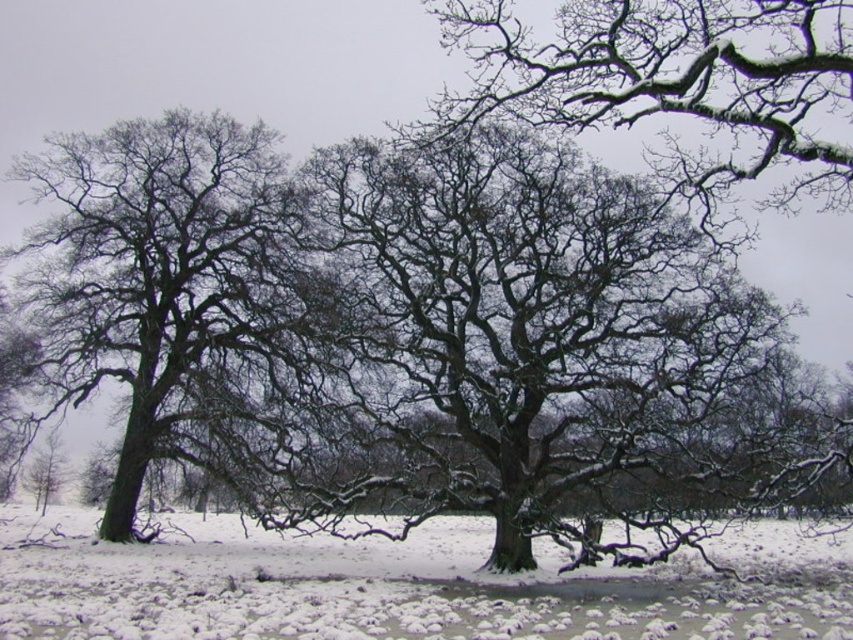
Question: Is white powdery snow at center to the right of snow-covered branches at upper center from the viewer's perspective?

Choices:
 (A) yes
 (B) no

Answer: (B)

Question: Which point appears farthest from the camera in this image?

Choices:
 (A) (209, 237)
 (B) (730, 64)

Answer: (A)

Question: Does white powdery snow at center appear over snow-covered branches at upper center?

Choices:
 (A) yes
 (B) no

Answer: (B)

Question: Among these objects, which one is nearest to the camera?

Choices:
 (A) snow-covered branches at left
 (B) snow-covered branches at upper center
 (C) white powdery snow at center

Answer: (B)

Question: Which object is closer to the camera taking this photo?

Choices:
 (A) snow-covered branches at upper center
 (B) snow-covered branches at left

Answer: (A)

Question: Is snow-covered branches at left closer to the viewer compared to snow-covered branches at upper center?

Choices:
 (A) no
 (B) yes

Answer: (A)